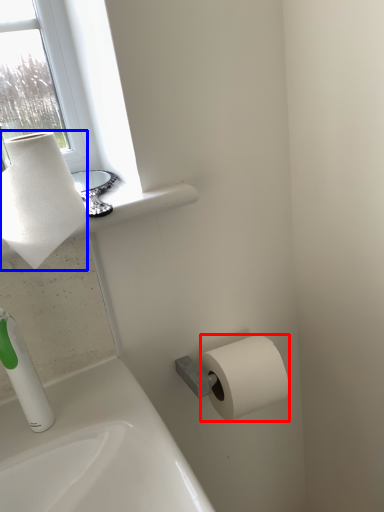
Question: Which of the following is the farthest to the observer, toilet paper (highlighted by a red box) or paper towel (highlighted by a blue box)?

Choices:
 (A) toilet paper
 (B) paper towel

Answer: (A)